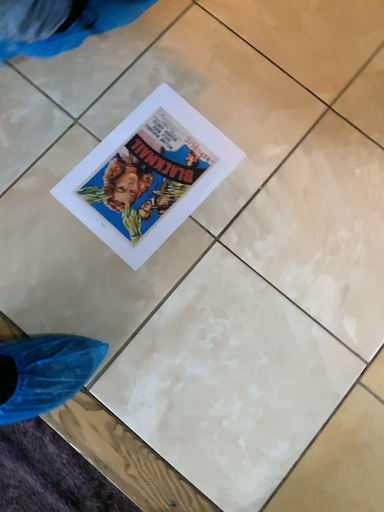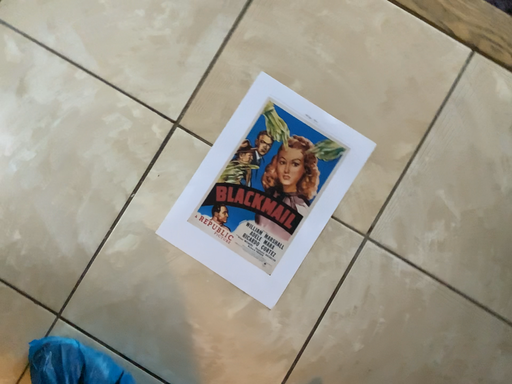
Question: How did the camera likely rotate when shooting the video?

Choices:
 (A) rotated upward
 (B) rotated downward

Answer: (A)